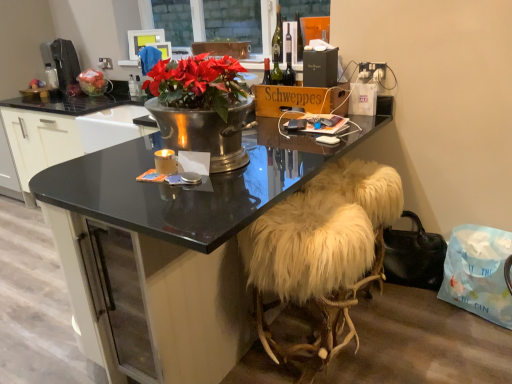
Find the location of a particular element. vacant area that is in front of black leather handbag at lower right is located at coordinates (476, 344).